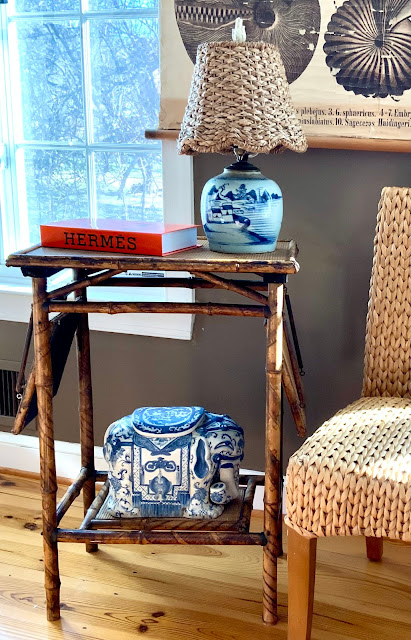
Image resolution: width=411 pixels, height=640 pixels. In order to click on seat in this screenshot , I will do [360, 452].